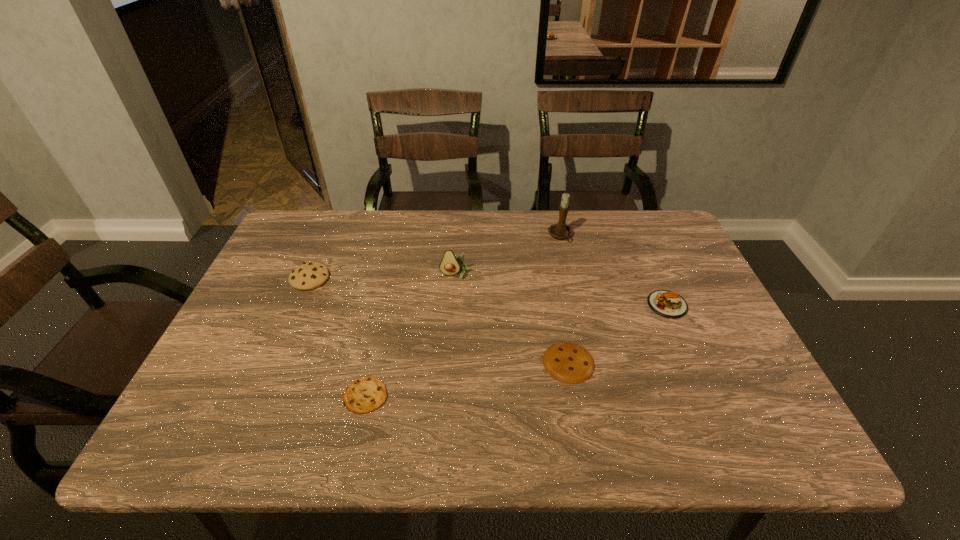
You are a GUI agent. You are given a task and a screenshot of the screen. Output one action in this format:
    pyautogui.click(x=<x>, y=<y>)
    Task: Click on the vacant space at the near edge of the desktop
    The height and width of the screenshot is (540, 960).
    Given the screenshot: What is the action you would take?
    pyautogui.click(x=403, y=446)

Where is `vacant position at the left edge of the desktop`? This screenshot has width=960, height=540. vacant position at the left edge of the desktop is located at coordinates (268, 259).

The image size is (960, 540). Find the location of `vacant space at the right edge`. vacant space at the right edge is located at coordinates (745, 411).

Image resolution: width=960 pixels, height=540 pixels. I want to click on vacant space at the far left corner, so click(x=316, y=242).

I want to click on vacant space at the far right corner of the desktop, so click(664, 233).

I want to click on free space between the farthest cookie and the patty (food), so click(x=489, y=292).

Where is `free spot between the rightmost object and the rightmost cookie`? free spot between the rightmost object and the rightmost cookie is located at coordinates (618, 334).

This screenshot has width=960, height=540. Find the location of `unoccupied area between the rightmost object and the avocado`. unoccupied area between the rightmost object and the avocado is located at coordinates (562, 290).

Where is `vacant area between the third object from left to right and the rightmost cookie`? This screenshot has height=540, width=960. vacant area between the third object from left to right and the rightmost cookie is located at coordinates (513, 319).

Identify the location of unoccupied area between the second cookie from right to left and the rightmost object. Image resolution: width=960 pixels, height=540 pixels. (516, 350).